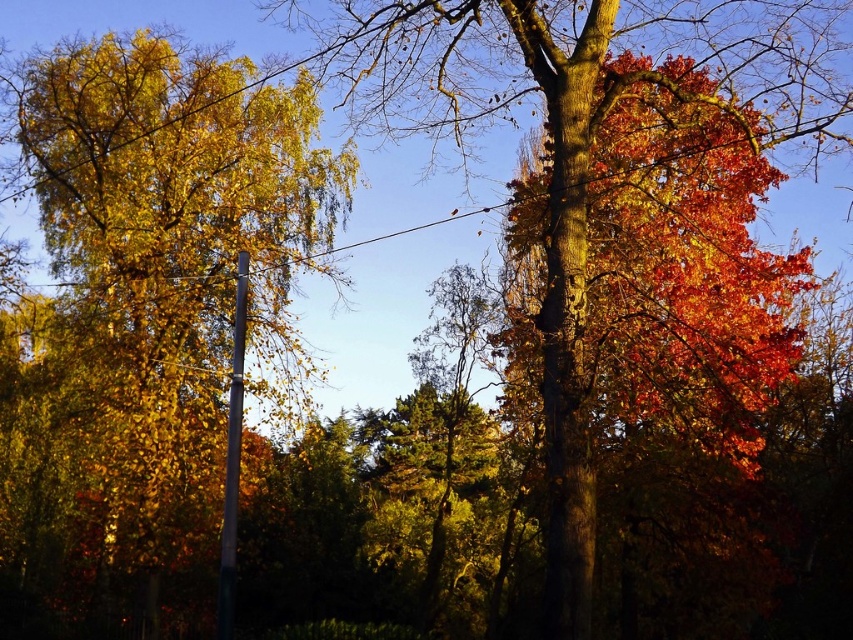
Question: Does golden yellow leaves at left appear over metallic pole at left?

Choices:
 (A) yes
 (B) no

Answer: (A)

Question: Which point is closer to the camera?

Choices:
 (A) (218, 620)
 (B) (120, 195)

Answer: (A)

Question: Which point is farther to the camera?

Choices:
 (A) metallic pole at left
 (B) golden yellow leaves at left

Answer: (B)

Question: From the image, what is the correct spatial relationship of golden yellow leaves at left in relation to metallic pole at left?

Choices:
 (A) right
 (B) left

Answer: (B)

Question: Does golden yellow leaves at left have a smaller size compared to metallic pole at left?

Choices:
 (A) no
 (B) yes

Answer: (A)

Question: Among these points, which one is farthest from the camera?

Choices:
 (A) (140, 256)
 (B) (236, 285)

Answer: (A)